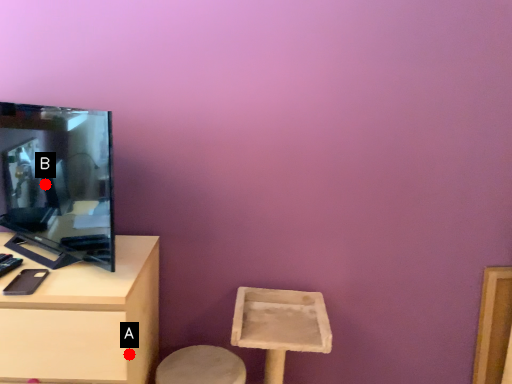
Question: Two points are circled on the image, labeled by A and B beside each circle. Which point is further to the camera?

Choices:
 (A) A is further
 (B) B is further

Answer: (B)